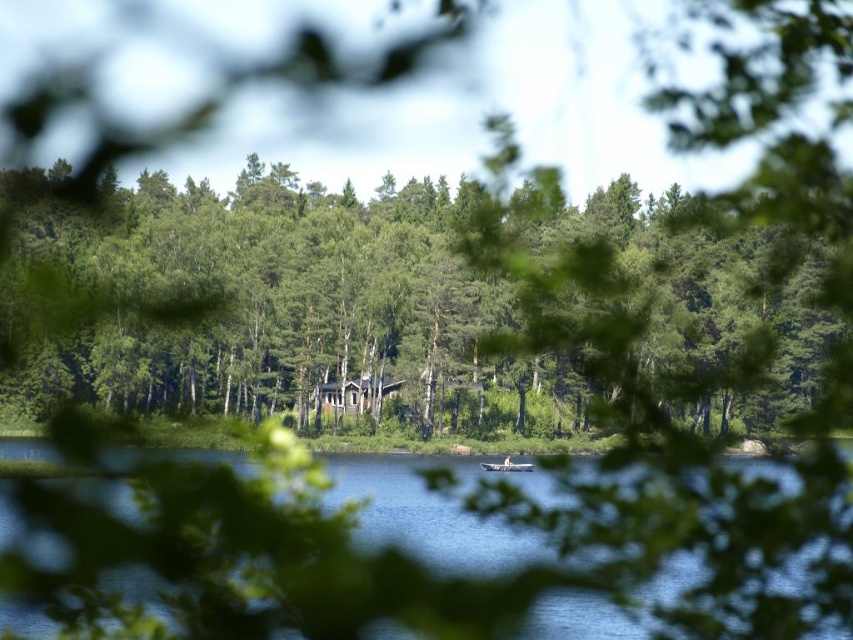
You are planning to take a photo of the wooden boat at center without the green leafy trees at center blocking the view. Based on their sizes, which object should you move closer to or farther from to achieve this?

Since the green leafy trees at center are larger than the wooden boat at center, moving closer to the wooden boat at center and farther from the green leafy trees at center would reduce the apparent size of the trees while enlarging the boat, thus minimizing obstruction.

You are standing at the lakeside and want to take a photo of both the green leafy trees at center and the wooden boat at center. Which object should you position closer to the left side of your camera frame?

You should position the green leafy trees at center closer to the left side of your camera frame since the green leafy trees at center is to the left of wooden boat at center according to the description.